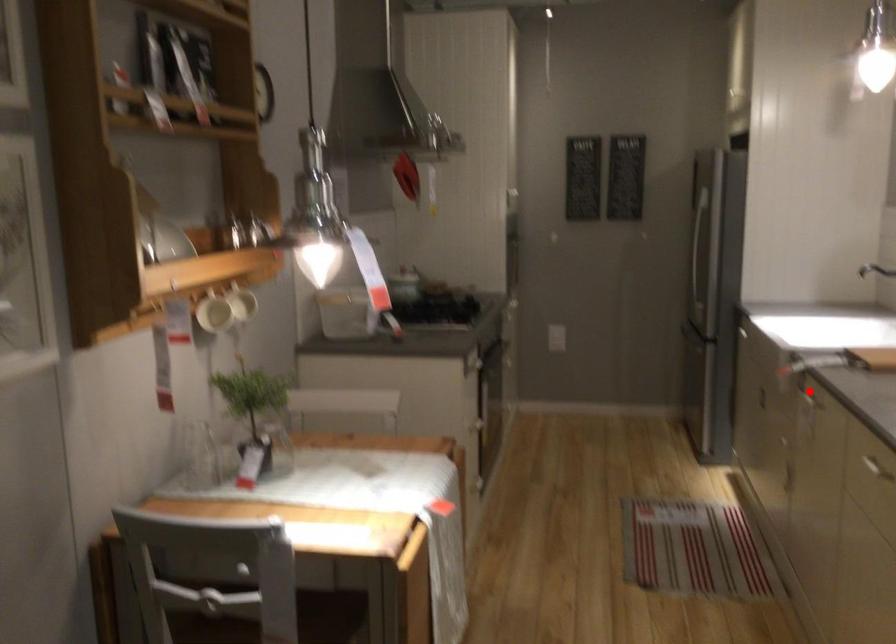
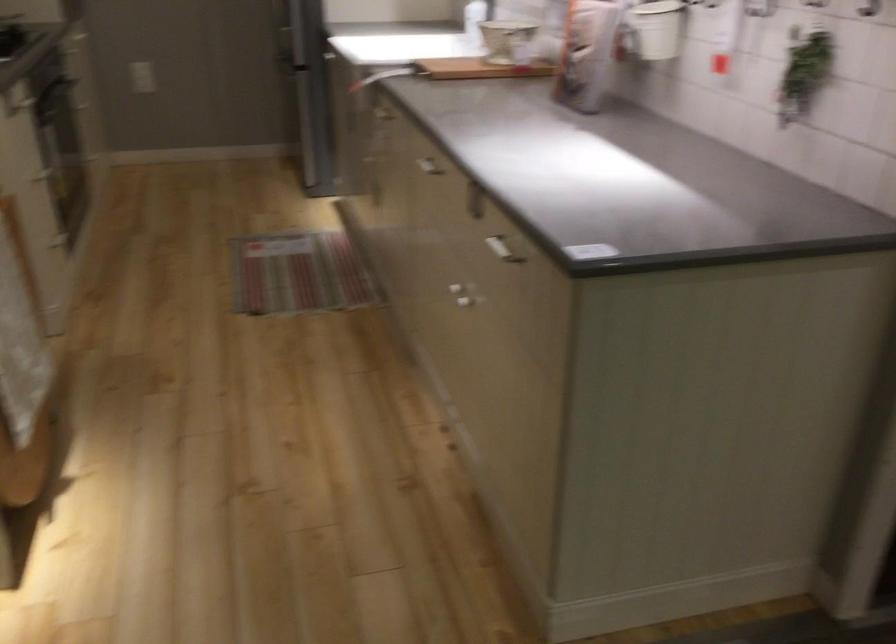
Question: I am providing you with two images of the same scene from different viewpoints. A red point is marked on the first image. Is the red point's position out of view in image 2?

Choices:
 (A) Yes
 (B) No

Answer: (A)